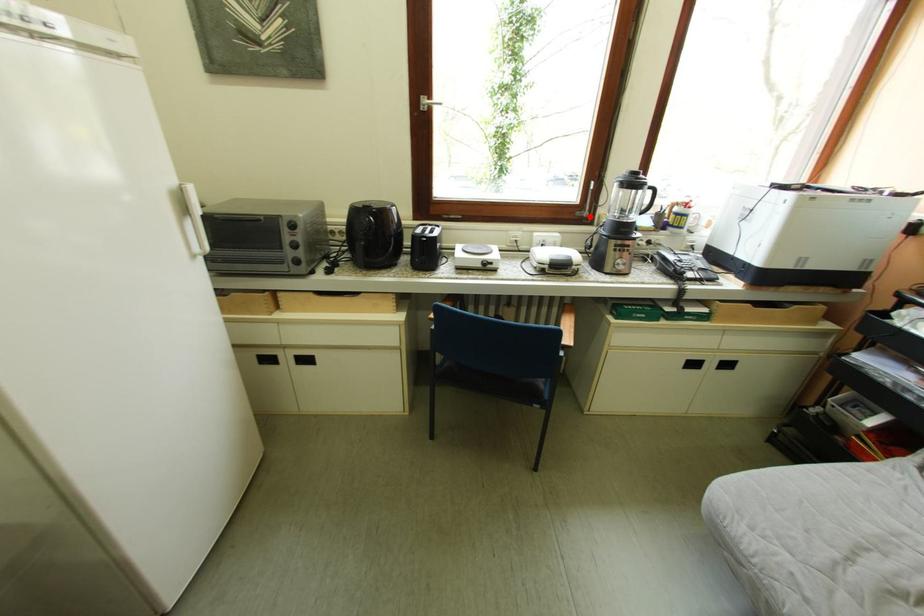
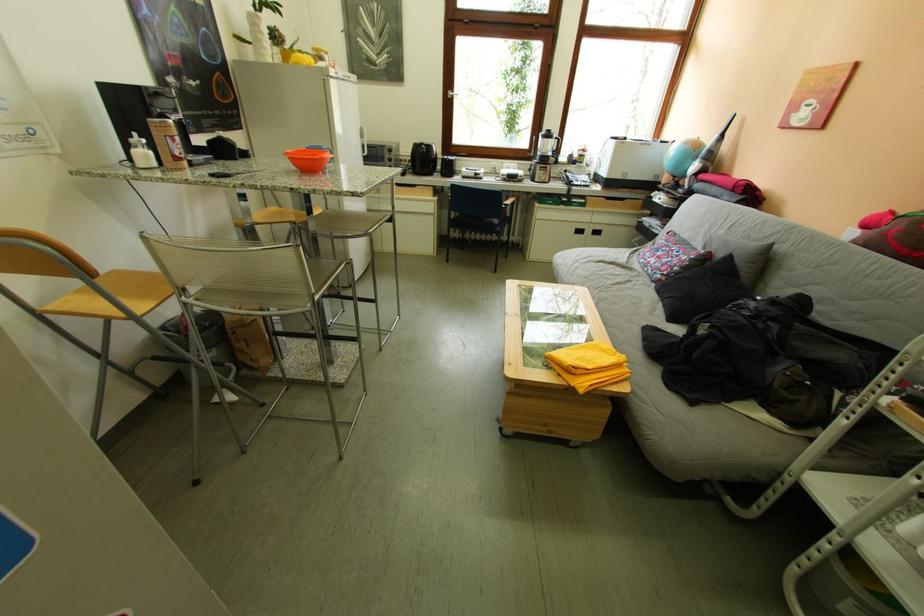
Where in the second image is the point corresponding to the highlighted location from the first image?

(541, 156)